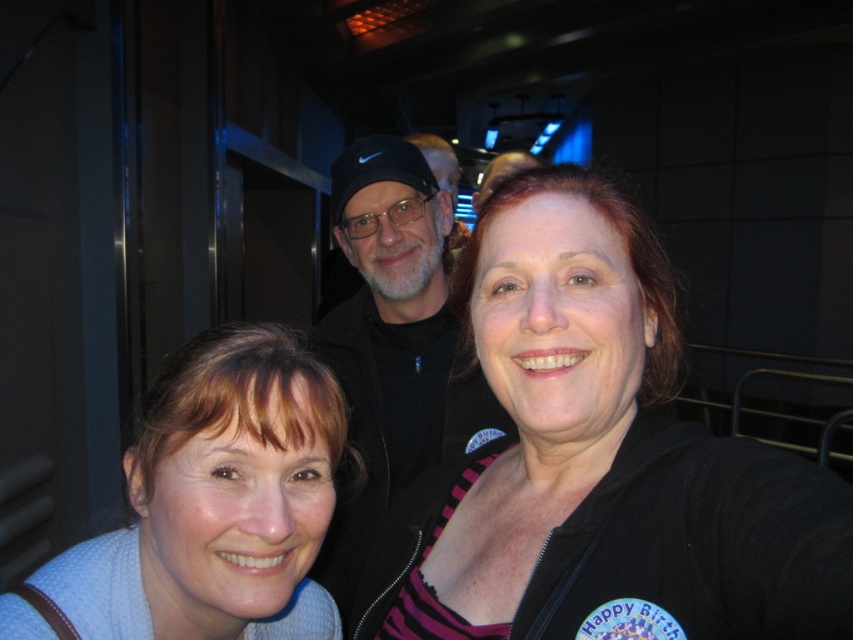
Question: Can you confirm if blue knit sweater at lower left is smaller than black fabric at center?

Choices:
 (A) yes
 (B) no

Answer: (A)

Question: From the image, what is the correct spatial relationship of blue knit sweater at lower left in relation to black fabric at center?

Choices:
 (A) right
 (B) left

Answer: (B)

Question: Among these points, which one is nearest to the camera?

Choices:
 (A) (276, 516)
 (B) (548, 284)

Answer: (A)

Question: Is black matte jacket at center wider than black fabric at center?

Choices:
 (A) no
 (B) yes

Answer: (A)

Question: Which is nearer to the black fabric at center?

Choices:
 (A) blue knit sweater at lower left
 (B) black matte jacket at center

Answer: (B)

Question: Which is farther from the black matte jacket at center?

Choices:
 (A) black fabric at center
 (B) blue knit sweater at lower left

Answer: (A)